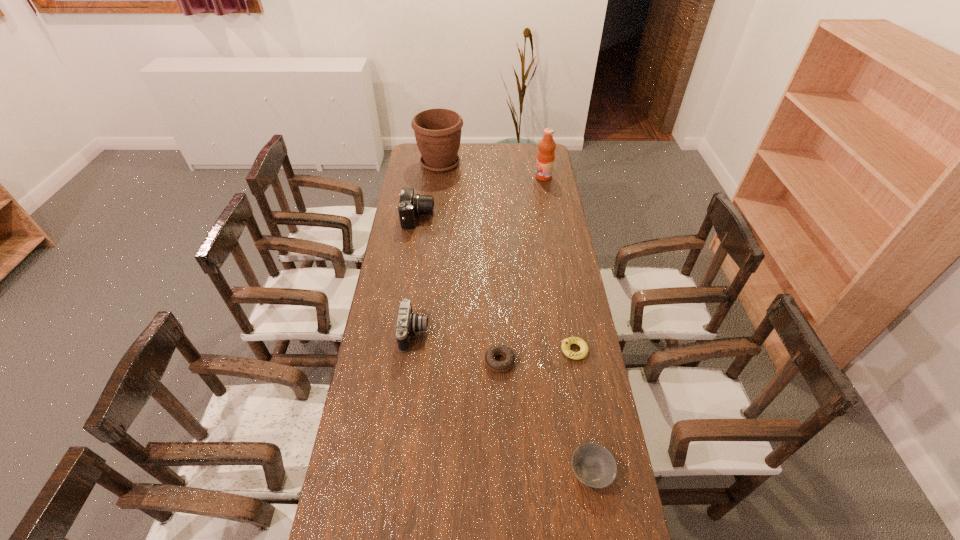
You are a GUI agent. You are given a task and a screenshot of the screen. Output one action in this format:
    pyautogui.click(x=<x>, y=<y>)
    Task: Click on the free space between the flowerpot and the sixth tallest object
    
    Given the screenshot: What is the action you would take?
    pyautogui.click(x=516, y=317)

Choose which object is the nearest neighbor to the farther camera. Please provide its 2D coordinates. Your answer should be formatted as a tuple, i.e. [(x, y)], where the tuple contains the x and y coordinates of a point satisfying the conditions above.

[(437, 131)]

You are a GUI agent. You are given a task and a screenshot of the screen. Output one action in this format:
    pyautogui.click(x=<x>, y=<y>)
    Task: Click on the closest object to the nearest object
    
    Given the screenshot: What is the action you would take?
    pyautogui.click(x=499, y=366)

You are a GUI agent. You are given a task and a screenshot of the screen. Output one action in this format:
    pyautogui.click(x=<x>, y=<y>)
    Task: Click on the vacant space that satisfies the following two spatial constraints: 1. on the lens of the bowl; 2. on the left side of the farther camera
    
    Given the screenshot: What is the action you would take?
    [x=379, y=471]

Locate an element on the screen. Image resolution: width=960 pixels, height=540 pixels. free spot that satisfies the following two spatial constraints: 1. on the lens of the farther camera; 2. on the back side of the nearest object is located at coordinates (379, 471).